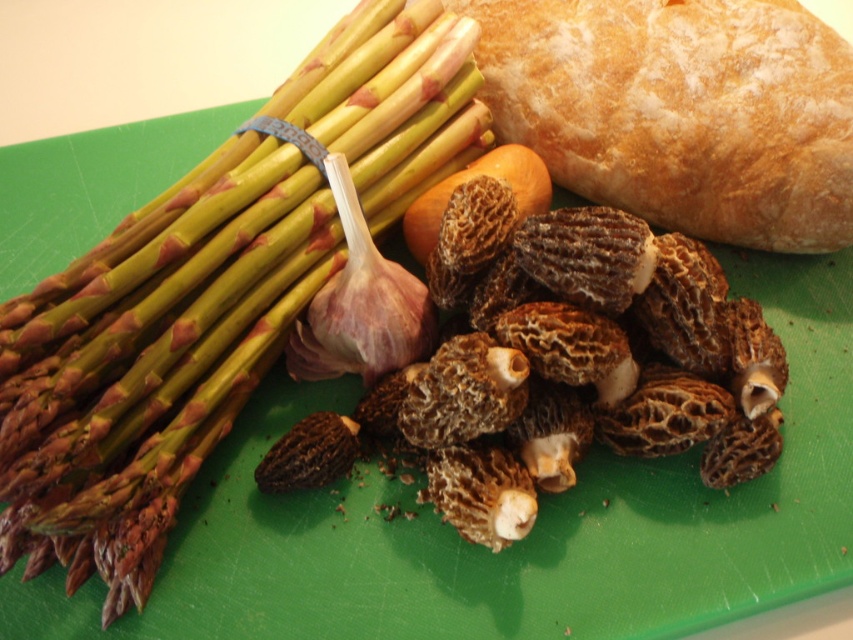
Question: Does green matte asparagus at left appear on the left side of brown fibrous mushrooms at center?

Choices:
 (A) no
 (B) yes

Answer: (B)

Question: Is green matte asparagus at left positioned behind purple papery garlic at center?

Choices:
 (A) no
 (B) yes

Answer: (A)

Question: Does green matte asparagus at left appear on the right side of golden brown crusty loaf at upper right?

Choices:
 (A) no
 (B) yes

Answer: (A)

Question: Which point is farther from the camera taking this photo?

Choices:
 (A) (407, 278)
 (B) (370, 193)

Answer: (B)

Question: Which point is farther to the camera?

Choices:
 (A) (337, 193)
 (B) (386, 156)
 (C) (747, 38)
 (D) (595, 301)

Answer: (B)

Question: Which point appears farthest from the camera in this image?

Choices:
 (A) (370, 364)
 (B) (734, 412)
 (C) (39, 300)
 (D) (683, 141)

Answer: (D)